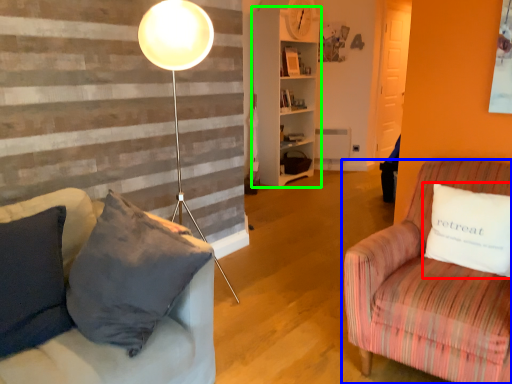
Question: Based on their relative distances, which object is nearer to pillow (highlighted by a red box)? Choose from studio couch (highlighted by a blue box) and shelf (highlighted by a green box).

Choices:
 (A) studio couch
 (B) shelf

Answer: (A)